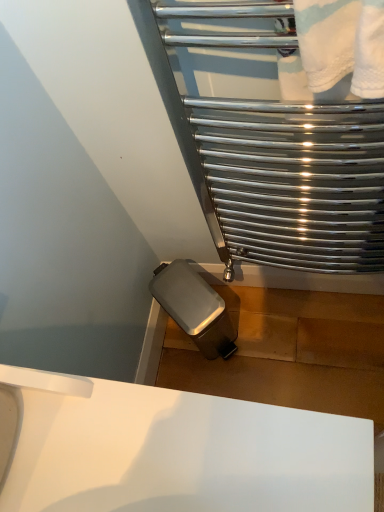
This screenshot has width=384, height=512. What do you see at coordinates (273, 155) in the screenshot?
I see `polished chrome towel rack at upper right` at bounding box center [273, 155].

Measure the distance between polished chrome towel rack at upper right and camera.

They are 49.50 centimeters apart.

Consider the image. What is the approximate width of polished chrome towel rack at upper right?

It is 9.96 centimeters.

Find the location of a particular element. This screenshot has height=512, width=384. polished chrome towel rack at upper right is located at coordinates [x=273, y=155].

What do you see at coordinates (178, 451) in the screenshot?
I see `white glossy sink at lower center` at bounding box center [178, 451].

Where is `white glossy sink at lower center`? The width and height of the screenshot is (384, 512). white glossy sink at lower center is located at coordinates (178, 451).

What is the approximate width of white glossy sink at lower center?

The width of white glossy sink at lower center is 57.77 centimeters.

The image size is (384, 512). What are the coordinates of `polished chrome towel rack at upper right` in the screenshot? It's located at tap(273, 155).

Visually, is polished chrome towel rack at upper right positioned to the left or to the right of white glossy sink at lower center?

polished chrome towel rack at upper right is positioned on white glossy sink at lower center's right side.

Considering the relative positions of polished chrome towel rack at upper right and white glossy sink at lower center in the image provided, is polished chrome towel rack at upper right behind white glossy sink at lower center?

Yes, polished chrome towel rack at upper right is behind white glossy sink at lower center.

Between point (230, 203) and point (83, 400), which one is positioned in front?

The point (83, 400) is closer.

From the image's perspective, does polished chrome towel rack at upper right appear lower than white glossy sink at lower center?

No, from the image's perspective, polished chrome towel rack at upper right is not beneath white glossy sink at lower center.

From a real-world perspective, is polished chrome towel rack at upper right physically below white glossy sink at lower center?

Yes, from a real-world perspective, polished chrome towel rack at upper right is beneath white glossy sink at lower center.

Consider the image. Can you confirm if polished chrome towel rack at upper right is wider than white glossy sink at lower center?

No, polished chrome towel rack at upper right is not wider than white glossy sink at lower center.

Looking at this image, from their relative heights in the image, would you say polished chrome towel rack at upper right is taller or shorter than white glossy sink at lower center?

Considering their sizes, polished chrome towel rack at upper right has more height than white glossy sink at lower center.

Is polished chrome towel rack at upper right bigger than white glossy sink at lower center?

Actually, polished chrome towel rack at upper right might be smaller than white glossy sink at lower center.

Would you say polished chrome towel rack at upper right is inside or outside white glossy sink at lower center?

polished chrome towel rack at upper right is not inside white glossy sink at lower center, it's outside.

Can you see polished chrome towel rack at upper right touching white glossy sink at lower center?

No, polished chrome towel rack at upper right is not in contact with white glossy sink at lower center.

Is polished chrome towel rack at upper right oriented towards white glossy sink at lower center?

Yes.

How different are the orientations of polished chrome towel rack at upper right and white glossy sink at lower center in degrees?

There is a 89.8-degree angle between the facing directions of polished chrome towel rack at upper right and white glossy sink at lower center.

In order to click on sink below the polished chrome towel rack at upper right (from the image's perspective) in this screenshot , I will do `click(178, 451)`.

Considering the positions of objects white glossy sink at lower center and polished chrome towel rack at upper right in the image provided, who is more to the left, white glossy sink at lower center or polished chrome towel rack at upper right?

From the viewer's perspective, white glossy sink at lower center appears more on the left side.

Does white glossy sink at lower center lie behind polished chrome towel rack at upper right?

No, white glossy sink at lower center is closer to the camera.

Is point (60, 464) less distant than point (245, 38)?

Yes, it is in front of point (245, 38).

From the image's perspective, is white glossy sink at lower center located beneath polished chrome towel rack at upper right?

Indeed, from the image's perspective, white glossy sink at lower center is shown beneath polished chrome towel rack at upper right.

From a real-world perspective, which is physically above, white glossy sink at lower center or polished chrome towel rack at upper right?

From a 3D spatial view, white glossy sink at lower center is above.

Looking at this image, considering the sizes of objects white glossy sink at lower center and polished chrome towel rack at upper right in the image provided, who is thinner, white glossy sink at lower center or polished chrome towel rack at upper right?

Thinner between the two is polished chrome towel rack at upper right.

From their relative heights in the image, would you say white glossy sink at lower center is taller or shorter than polished chrome towel rack at upper right?

Clearly, white glossy sink at lower center is shorter compared to polished chrome towel rack at upper right.

Considering the relative sizes of white glossy sink at lower center and polished chrome towel rack at upper right in the image provided, is white glossy sink at lower center smaller than polished chrome towel rack at upper right?

Incorrect, white glossy sink at lower center is not smaller in size than polished chrome towel rack at upper right.

Is white glossy sink at lower center spatially inside polished chrome towel rack at upper right, or outside of it?

white glossy sink at lower center is located beyond the bounds of polished chrome towel rack at upper right.

Is white glossy sink at lower center beside polished chrome towel rack at upper right?

No, white glossy sink at lower center is not making contact with polished chrome towel rack at upper right.

Is white glossy sink at lower center aimed at polished chrome towel rack at upper right?

No, white glossy sink at lower center is not facing towards polished chrome towel rack at upper right.

The height and width of the screenshot is (512, 384). I want to click on glass door that is behind the white glossy sink at lower center, so click(273, 155).

Identify the location of glass door lying behind the white glossy sink at lower center. (273, 155).

In order to click on sink below the polished chrome towel rack at upper right (from the image's perspective) in this screenshot , I will do `click(178, 451)`.